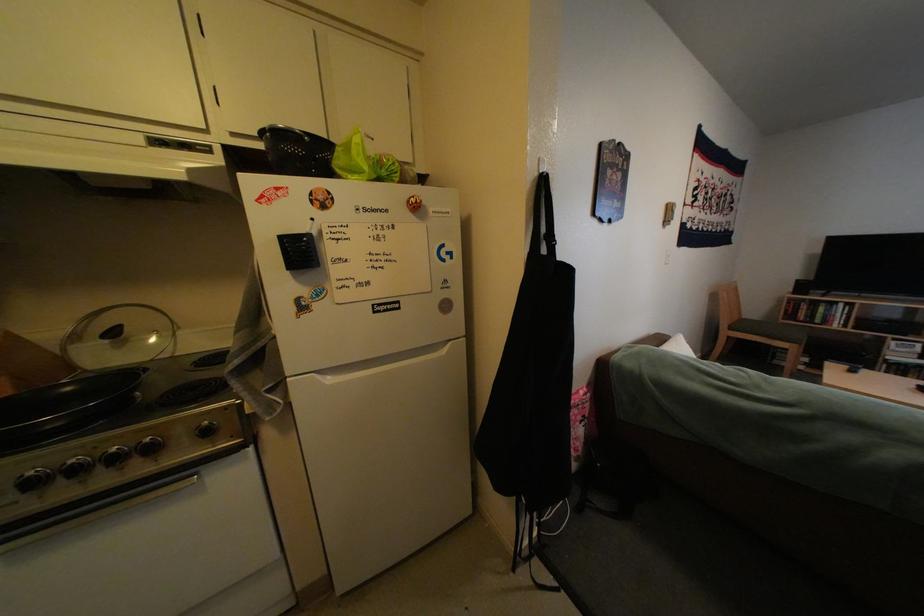
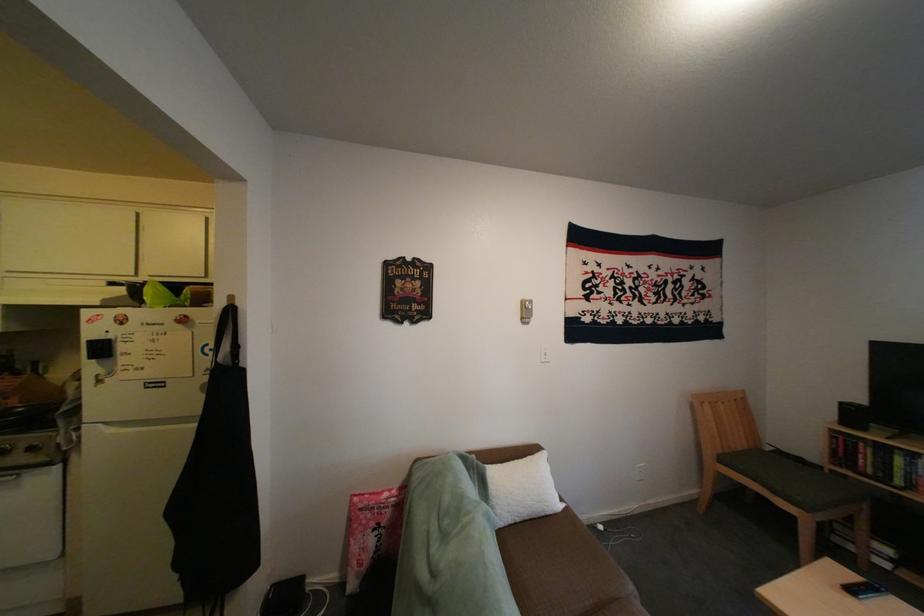
Question: What movement of the cameraman would produce the second image?

Choices:
 (A) Left
 (B) Right
 (C) Forward
 (D) Backward

Answer: (B)